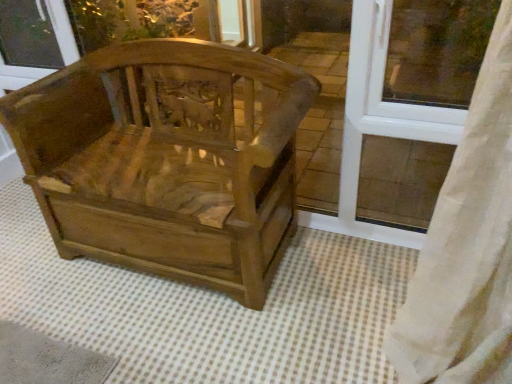
You are a GUI agent. You are given a task and a screenshot of the screen. Output one action in this format:
    pyautogui.click(x=<x>, y=<y>)
    Task: Click on the free space in front of wooden carved chair at center
    
    Given the screenshot: What is the action you would take?
    pyautogui.click(x=165, y=339)